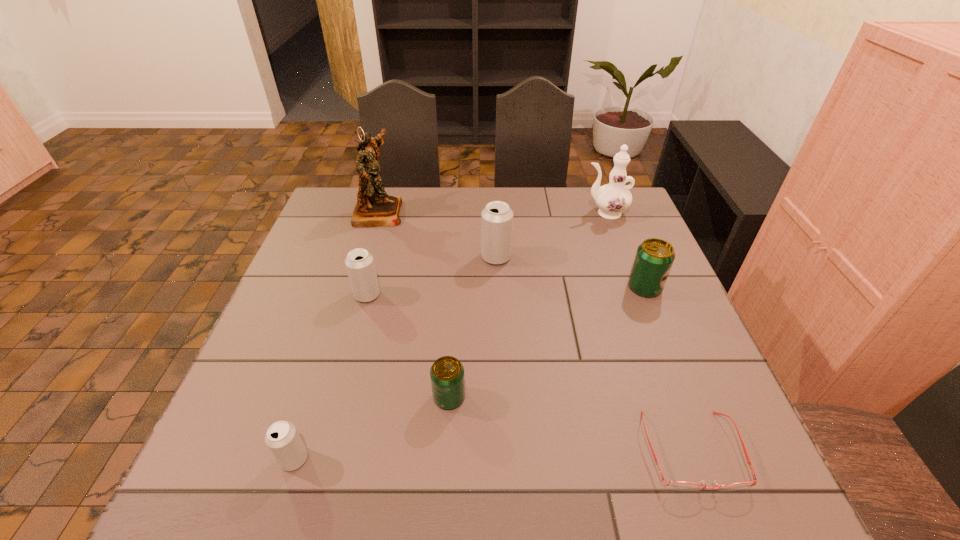
Where is `gold figurine`? This screenshot has height=540, width=960. gold figurine is located at coordinates (374, 208).

I want to click on figurine, so click(374, 208).

Locate an element on the screen. This screenshot has width=960, height=540. chinaware is located at coordinates (613, 198).

Identify the location of the sixth nearest object. (496, 218).

The width and height of the screenshot is (960, 540). I want to click on the farthest white beer can, so click(x=496, y=218).

Where is `the second biggest white beer can`? the second biggest white beer can is located at coordinates (359, 263).

At what (x,y) coordinates should I click in order to perform the action: click on the right green beer can. Please return your answer as a coordinate pair (x, y). The image size is (960, 540). Looking at the image, I should click on (654, 258).

What are the coordinates of `the bigger green beer can` in the screenshot? It's located at (654, 258).

This screenshot has height=540, width=960. What are the coordinates of `the smaller green beer can` in the screenshot? It's located at (447, 376).

Locate an element on the screen. the sixth farthest object is located at coordinates (447, 376).